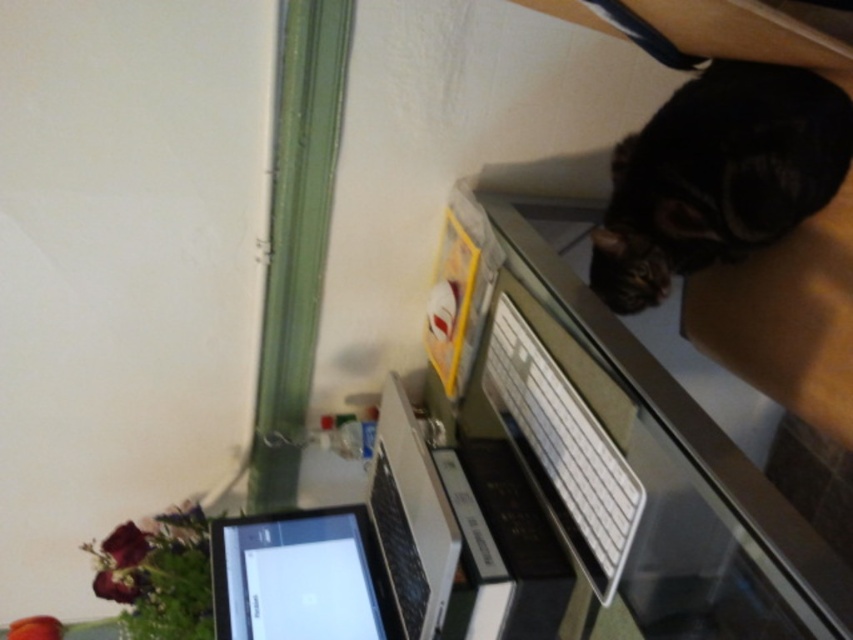
Does satin black laptop at lower left appear on the left side of black glossy tablet at lower left?

No, satin black laptop at lower left is not to the left of black glossy tablet at lower left.

Can you confirm if satin black laptop at lower left is shorter than black glossy tablet at lower left?

In fact, satin black laptop at lower left may be taller than black glossy tablet at lower left.

Identify the location of satin black laptop at lower left. The height and width of the screenshot is (640, 853). (345, 552).

The height and width of the screenshot is (640, 853). Identify the location of satin black laptop at lower left. (345, 552).

Which is more to the left, black fur cat at upper right or satin black laptop at lower left?

satin black laptop at lower left is more to the left.

You are a GUI agent. You are given a task and a screenshot of the screen. Output one action in this format:
    pyautogui.click(x=<x>, y=<y>)
    Task: Click on the black fur cat at upper right
    The width and height of the screenshot is (853, 640).
    Given the screenshot: What is the action you would take?
    pyautogui.click(x=718, y=176)

Describe the element at coordinates (718, 176) in the screenshot. Image resolution: width=853 pixels, height=640 pixels. I see `black fur cat at upper right` at that location.

Identify the location of black fur cat at upper right. (718, 176).

Can you confirm if white plastic keyboard at upper right is taller than satin black laptop at lower left?

Correct, white plastic keyboard at upper right is much taller as satin black laptop at lower left.

Does white plastic keyboard at upper right appear on the left side of satin black laptop at lower left?

In fact, white plastic keyboard at upper right is to the right of satin black laptop at lower left.

Does point (809, 602) come behind point (386, 579)?

No, (809, 602) is in front of (386, 579).

Locate an element on the screen. Image resolution: width=853 pixels, height=640 pixels. white plastic keyboard at upper right is located at coordinates (637, 472).